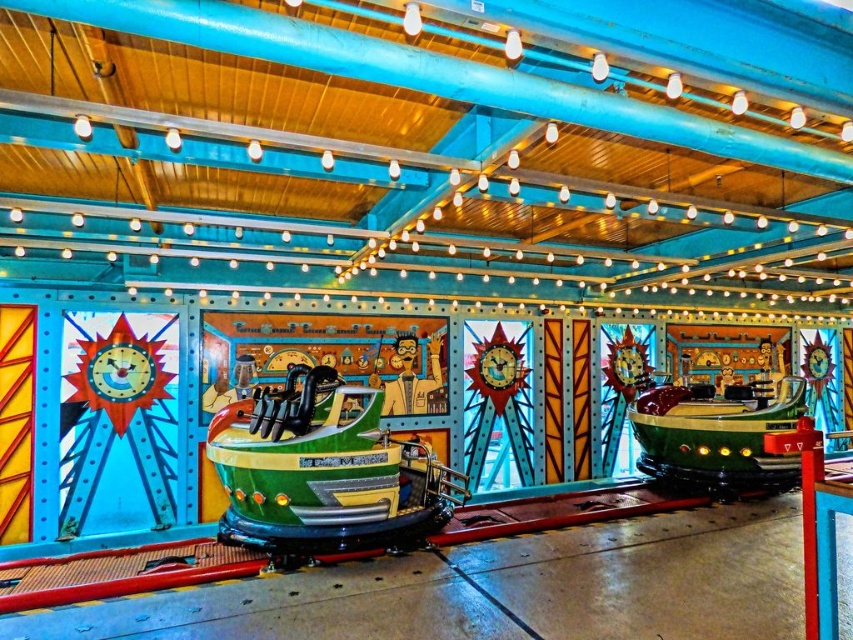
Is green shiny boat at center to the right of green matte boat at center from the viewer's perspective?

No, green shiny boat at center is not to the right of green matte boat at center.

Is green shiny boat at center above green matte boat at center?

No.

Where is `green shiny boat at center`? The image size is (853, 640). green shiny boat at center is located at coordinates (323, 472).